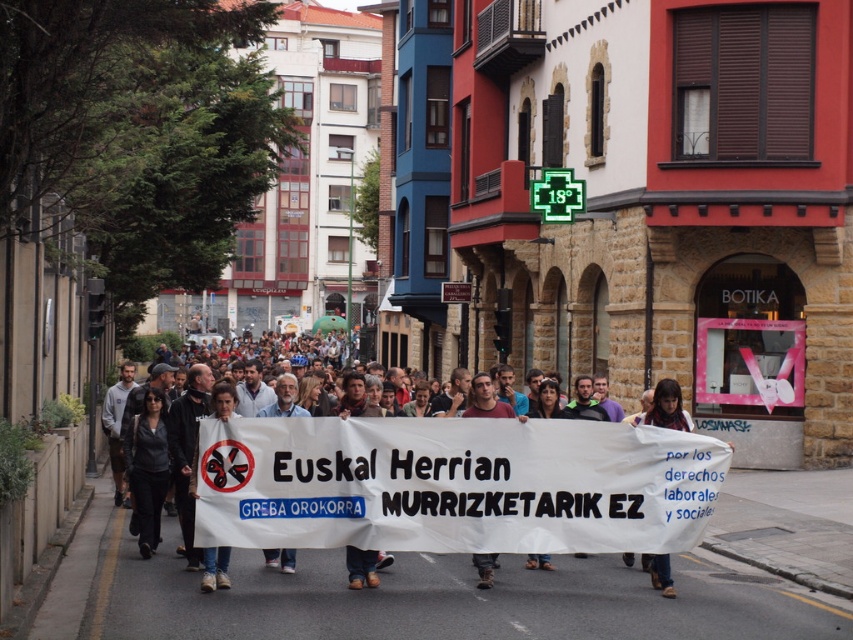
You are a photographer standing at the corner of the street. You want to capture the white paper banner at center in your photo. Based on its position, where should you aim your camera to ensure the banner is centered in the frame?

The white paper banner at center is located at point (451, 484), so you should aim your camera at that coordinate to center it in the frame.

You are a photographer standing at the edge of the protest. You notice the white paper banner at center and the dark brown leather shoes at lower center. Which object is taller when viewed from your position?

The white paper banner at center is taller than the dark brown leather shoes at lower center.